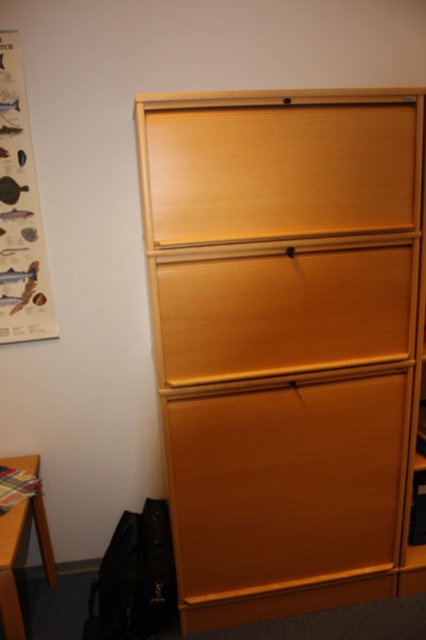
Is point (405, 385) closer to camera compared to point (291, 112)?

That is False.

Between point (215, 538) and point (204, 212), which one is positioned in front?

Positioned in front is point (204, 212).

Measure the distance between wooden drawer at lower center and camera.

The distance of wooden drawer at lower center from camera is 1.72 meters.

This screenshot has width=426, height=640. Identify the location of wooden drawer at lower center. (285, 484).

Does point (357, 296) come farther from viewer compared to point (46, 545)?

That is False.

Between wooden drawer at center and wooden table at lower left, which one is positioned higher?

Positioned higher is wooden drawer at center.

This screenshot has height=640, width=426. Describe the element at coordinates (284, 312) in the screenshot. I see `wooden drawer at center` at that location.

Locate an element on the screen. This screenshot has height=640, width=426. wooden drawer at center is located at coordinates (284, 312).

Can you confirm if matte wood drawer at upper center is bigger than wooden table at lower left?

Incorrect, matte wood drawer at upper center is not larger than wooden table at lower left.

In the scene shown: Does matte wood drawer at upper center appear on the left side of wooden table at lower left?

No, matte wood drawer at upper center is not to the left of wooden table at lower left.

Find the location of `matte wood drawer at upper center`. matte wood drawer at upper center is located at coordinates (281, 172).